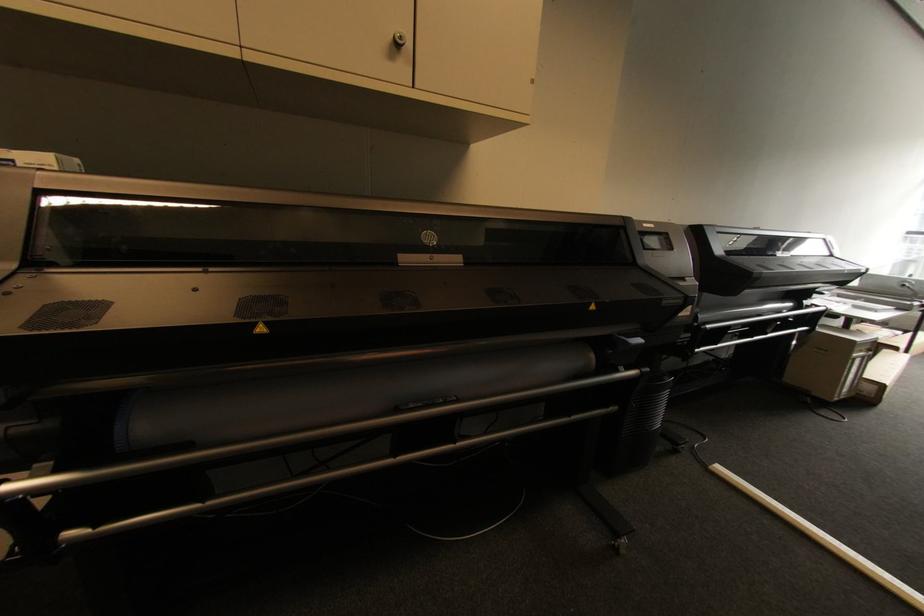
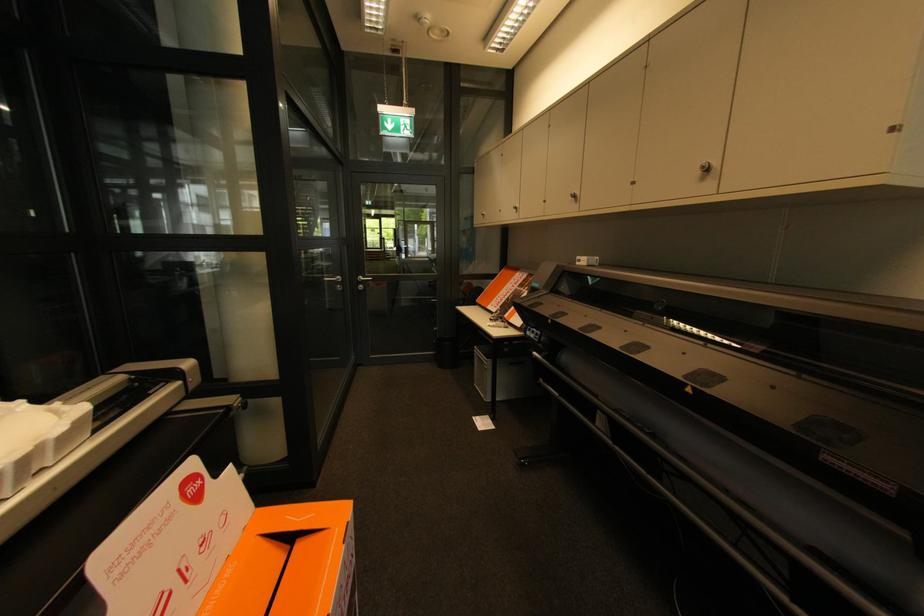
Question: I am providing you with two images of the same scene from different viewpoints. Please identify which objects are invisible in image2.

Choices:
 (A) large paper roll
 (B) orange cardboard box
 (C) metal cabinet knob
 (D) none of these

Answer: (D)